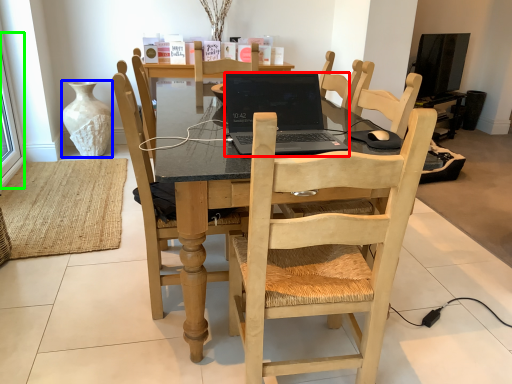
Question: Considering the real-world distances, which object is closest to laptop (highlighted by a red box)? vase (highlighted by a blue box) or window screen (highlighted by a green box).

Choices:
 (A) vase
 (B) window screen

Answer: (B)